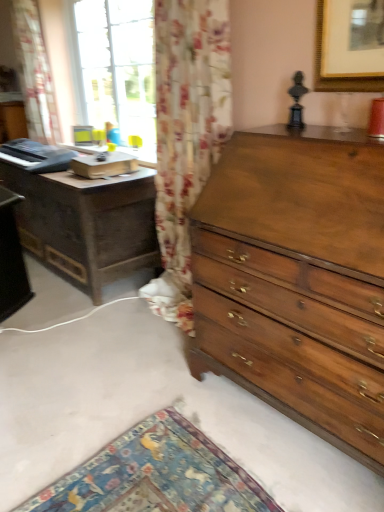
From the picture: What is the approximate height of dark wood nightstand at left?

dark wood nightstand at left is 28.49 inches in height.

What do you see at coordinates (86, 224) in the screenshot? The width and height of the screenshot is (384, 512). I see `dark wood nightstand at left` at bounding box center [86, 224].

From the picture: What is the approximate height of floral fabric curtain at left?

floral fabric curtain at left is 1.21 meters tall.

In order to face floral fabric curtain at left, should I rotate leftwards or rightwards?

It's best to rotate left around 20.442 degrees.

You are a GUI agent. You are given a task and a screenshot of the screen. Output one action in this format:
    pyautogui.click(x=<x>, y=<y>)
    Task: Click on the shiny brown wood chest of drawers at right
    
    Given the screenshot: What is the action you would take?
    pyautogui.click(x=296, y=283)

Is dark wood nightstand at left to the left or to the right of floral fabric curtain at left in the image?

dark wood nightstand at left is positioned on floral fabric curtain at left's right side.

Relative to floral fabric curtain at left, is dark wood nightstand at left in front or behind?

dark wood nightstand at left is positioned closer to the viewer than floral fabric curtain at left.

Considering the points (83, 246) and (46, 136), which point is in front, point (83, 246) or point (46, 136)?

The point (83, 246) is in front.

Are dark wood nightstand at left and floral fabric curtain at left located far from each other?

dark wood nightstand at left is far away from floral fabric curtain at left.

Is floral fabric curtain at left to the right of shiny brown wood chest of drawers at right from the viewer's perspective?

Incorrect, floral fabric curtain at left is not on the right side of shiny brown wood chest of drawers at right.

Which of these two, floral fabric curtain at left or shiny brown wood chest of drawers at right, stands taller?

With more height is floral fabric curtain at left.

The height and width of the screenshot is (512, 384). Identify the location of chest of drawers lying on the right of floral fabric curtain at left. (296, 283).

Is floral fabric curtain at left looking in the opposite direction of shiny brown wood chest of drawers at right?

No.

Does shiny brown wood chest of drawers at right have a lesser height compared to dark wood nightstand at left?

Incorrect, the height of shiny brown wood chest of drawers at right does not fall short of that of dark wood nightstand at left.

Is shiny brown wood chest of drawers at right aimed at dark wood nightstand at left?

No, shiny brown wood chest of drawers at right is not turned towards dark wood nightstand at left.

Based on the photo, is shiny brown wood chest of drawers at right spatially inside dark wood nightstand at left, or outside of it?

shiny brown wood chest of drawers at right is located beyond the bounds of dark wood nightstand at left.

Does shiny brown wood chest of drawers at right appear on the right side of dark wood nightstand at left?

Yes, shiny brown wood chest of drawers at right is to the right of dark wood nightstand at left.

Is shiny brown wood chest of drawers at right wider or thinner than floral fabric curtain at left?

In the image, shiny brown wood chest of drawers at right appears to be wider than floral fabric curtain at left.

In terms of size, does shiny brown wood chest of drawers at right appear bigger or smaller than floral fabric curtain at left?

Clearly, shiny brown wood chest of drawers at right is larger in size than floral fabric curtain at left.

From a real-world perspective, is shiny brown wood chest of drawers at right positioned under floral fabric curtain at left based on gravity?

Correct, in the physical world, shiny brown wood chest of drawers at right is lower than floral fabric curtain at left.

The width and height of the screenshot is (384, 512). Identify the location of curtain above the dark wood nightstand at left (from the image's perspective). (35, 73).

Is floral fabric curtain at left placed right next to dark wood nightstand at left?

They are not placed beside each other.

Looking at this image, does floral fabric curtain at left have a greater width compared to dark wood nightstand at left?

No, floral fabric curtain at left is not wider than dark wood nightstand at left.

Could you tell me if floral fabric curtain at left is facing dark wood nightstand at left?

No.

Where is `nightstand that is above the shiny brown wood chest of drawers at right (from the image's perspective)`? nightstand that is above the shiny brown wood chest of drawers at right (from the image's perspective) is located at coordinates [86, 224].

In the scene shown: Does dark wood nightstand at left contain shiny brown wood chest of drawers at right?

No, shiny brown wood chest of drawers at right is located outside of dark wood nightstand at left.

Are dark wood nightstand at left and shiny brown wood chest of drawers at right far apart?

Yes, dark wood nightstand at left and shiny brown wood chest of drawers at right are quite far apart.

Is dark wood nightstand at left at the left side of shiny brown wood chest of drawers at right?

Indeed, dark wood nightstand at left is positioned on the left side of shiny brown wood chest of drawers at right.

The height and width of the screenshot is (512, 384). Find the location of `nightstand below the floral fabric curtain at left (from the image's perspective)`. nightstand below the floral fabric curtain at left (from the image's perspective) is located at coordinates (86, 224).

Where is `chest of drawers below the floral fabric curtain at left (from a real-world perspective)`? This screenshot has width=384, height=512. chest of drawers below the floral fabric curtain at left (from a real-world perspective) is located at coordinates pyautogui.click(x=296, y=283).

Which object lies nearer to the anchor point shiny brown wood chest of drawers at right, dark wood nightstand at left or floral fabric curtain at left?

Based on the image, dark wood nightstand at left appears to be nearer to shiny brown wood chest of drawers at right.

Looking at the image, which one is located closer to floral fabric curtain at left, dark wood nightstand at left or shiny brown wood chest of drawers at right?

The object closer to floral fabric curtain at left is dark wood nightstand at left.

Which object lies nearer to the anchor point floral fabric curtain at left, shiny brown wood chest of drawers at right or dark wood nightstand at left?

Based on the image, dark wood nightstand at left appears to be nearer to floral fabric curtain at left.

When comparing their distances from dark wood nightstand at left, does floral fabric curtain at left or shiny brown wood chest of drawers at right seem further?

Among the two, shiny brown wood chest of drawers at right is located further to dark wood nightstand at left.

Looking at the image, which one is located further to shiny brown wood chest of drawers at right, floral fabric curtain at left or dark wood nightstand at left?

Based on the image, floral fabric curtain at left appears to be further to shiny brown wood chest of drawers at right.

Considering their positions, is shiny brown wood chest of drawers at right positioned further to dark wood nightstand at left than floral fabric curtain at left?

Based on the image, shiny brown wood chest of drawers at right appears to be further to dark wood nightstand at left.

Locate an element on the screen. nightstand positioned between shiny brown wood chest of drawers at right and floral fabric curtain at left from near to far is located at coordinates (86, 224).